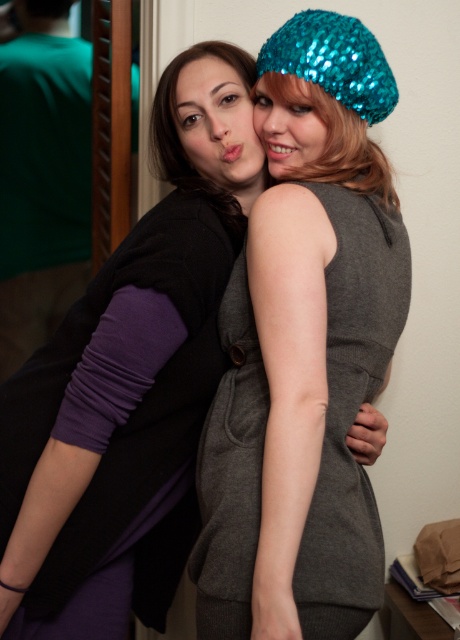
Does matte black face at upper left appear on the right side of shiny teal sequined hat at upper right?

Incorrect, matte black face at upper left is not on the right side of shiny teal sequined hat at upper right.

Is point (178, 102) farther from camera compared to point (297, 160)?

Yes, it is.

This screenshot has height=640, width=460. Find the location of `matte black face at upper left`. matte black face at upper left is located at coordinates (218, 125).

Between purple matte sweater at left and purple fabric at left, which one has more height?

purple fabric at left is taller.

Does purple matte sweater at left come in front of purple fabric at left?

Yes.

Does point (213, 83) come in front of point (38, 100)?

That is True.

This screenshot has width=460, height=640. Find the location of `purple matte sweater at left`. purple matte sweater at left is located at coordinates (137, 381).

Who is shorter, purple fabric at left or teal sequined beanie at upper right?

With less height is teal sequined beanie at upper right.

Between point (23, 104) and point (315, 44), which one is positioned in front?

Point (315, 44)

What do you see at coordinates (41, 179) in the screenshot? I see `purple fabric at left` at bounding box center [41, 179].

Locate an element on the screen. The height and width of the screenshot is (640, 460). purple fabric at left is located at coordinates (41, 179).